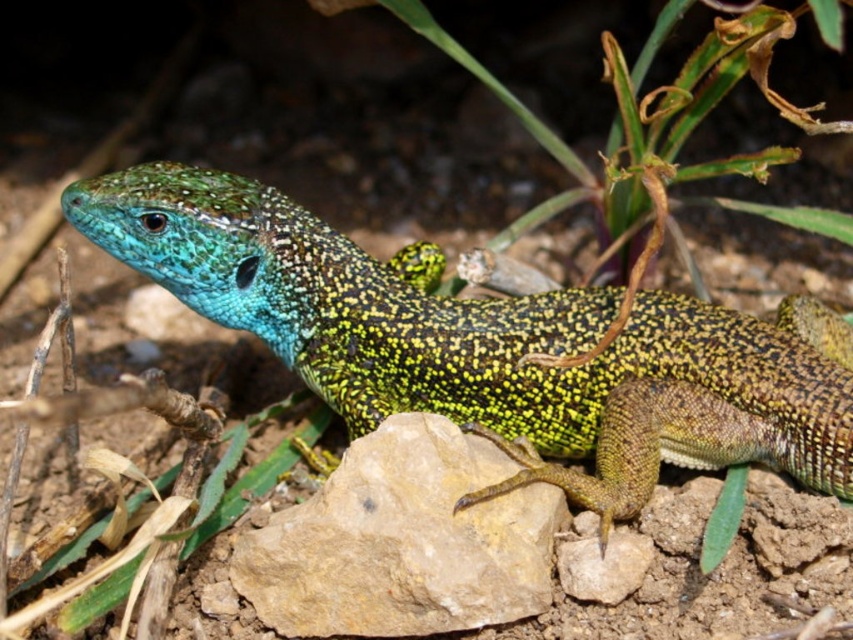
You are a photographer trying to capture the green speckled lizard at center and the brown rough rock at center in a single shot. Which object is closer to your camera lens?

The green speckled lizard at center is closer to the camera lens than the brown rough rock at center because it is further to the viewer.

You are a photographer aiming to capture the green speckled lizard at center and the smooth beige rock at center in a single frame. Based on their positions, which object is located to the left of the other?

The green speckled lizard at center is positioned on the left side of smooth beige rock at center.

You are a photographer trying to capture the green speckled lizard at center and the smooth beige rock at center in the same frame. Based on their sizes, which object would appear bigger in your photo?

The green speckled lizard at center would appear bigger in the photo since it has a larger size compared to the smooth beige rock at center.